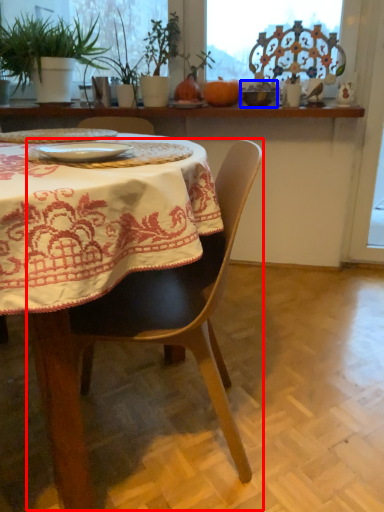
Question: Which object appears farthest to the camera in this image, chair (highlighted by a red box) or tableware (highlighted by a blue box)?

Choices:
 (A) chair
 (B) tableware

Answer: (B)